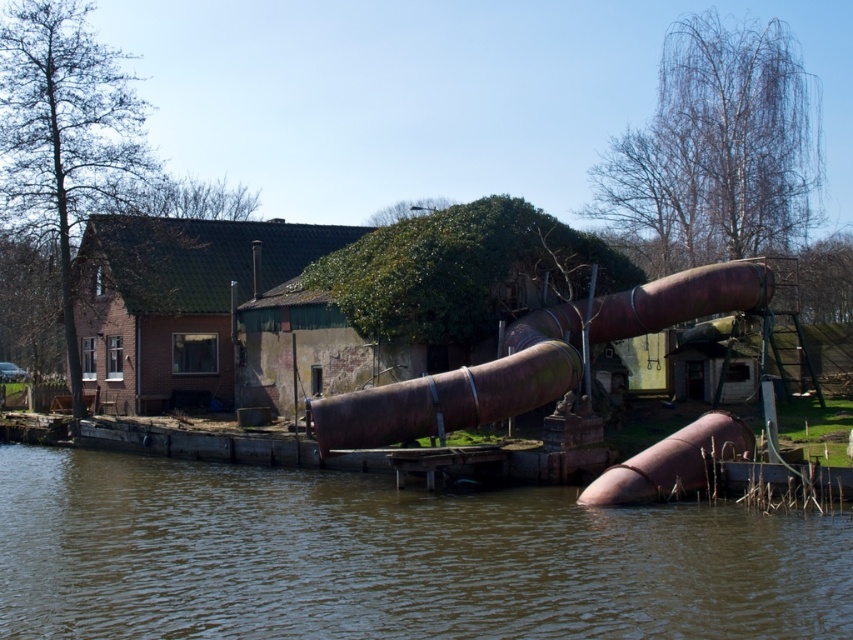
Question: Is brown muddy water at lower center above rusty metal pipe at center?

Choices:
 (A) yes
 (B) no

Answer: (B)

Question: Which point appears farthest from the camera in this image?

Choices:
 (A) (685, 548)
 (B) (637, 502)
 (C) (521, 412)

Answer: (C)

Question: Which point is closer to the camera taking this photo?

Choices:
 (A) (595, 496)
 (B) (56, 592)

Answer: (B)

Question: Which of the following is the farthest from the observer?

Choices:
 (A) (677, 468)
 (B) (746, 269)
 (C) (786, 600)

Answer: (B)

Question: Considering the relative positions of rusty metal pipe at center and rusty metallic pipe at lower center in the image provided, where is rusty metal pipe at center located with respect to rusty metallic pipe at lower center?

Choices:
 (A) below
 (B) above

Answer: (B)

Question: Is rusty metal pipe at center positioned at the back of rusty metallic pipe at lower center?

Choices:
 (A) no
 (B) yes

Answer: (B)